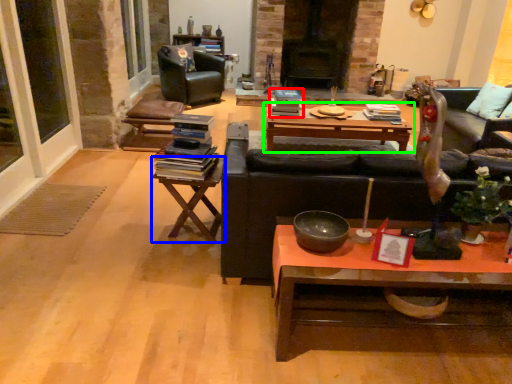
Question: Which object is positioned closest to book (highlighted by a red box)? Select from table (highlighted by a blue box) and coffee table (highlighted by a green box).

Choices:
 (A) table
 (B) coffee table

Answer: (B)